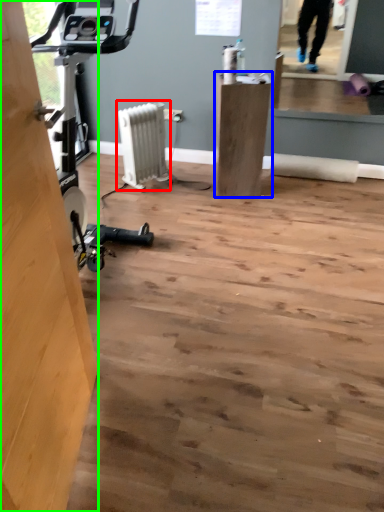
Question: Estimate the real-world distances between objects in this image. Which object is closer to radiator (highlighted by a red box), furniture (highlighted by a blue box) or plywood (highlighted by a green box)?

Choices:
 (A) furniture
 (B) plywood

Answer: (A)